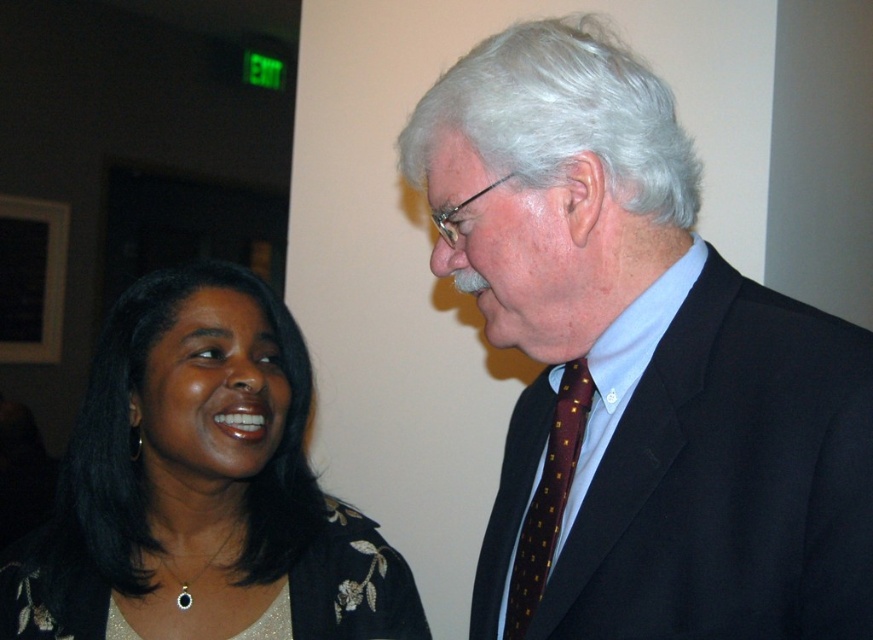
Consider the image. You are a fashion designer observing the scene. You need to determine which item has a shorter vertical dimension between the satin black dress at lower left and the maroon dotted tie at right. Which one is shorter?

The satin black dress at lower left has a lesser height compared to the maroon dotted tie at right, so the satin black dress at lower left is shorter in vertical dimension.

You are a tailor measuring garments for alterations. You need to determine if the black satin blouse at lower left can fit into a storage box designed for items narrower than the maroon dotted tie at right. Can the blouse fit?

The black satin blouse at lower left might be wider than the maroon dotted tie at right, so it may not fit into the storage box designed for items narrower than the maroon dotted tie at right.